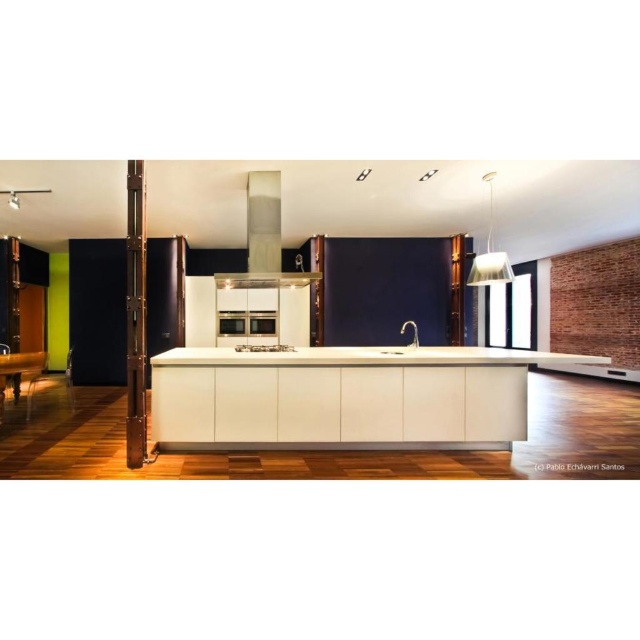
You are standing in the modern kitchen and want to place a small plant between the two points, point (237, 426) and point (257, 362). Which point should the plant be closer to in order to be closer to the viewer?

The plant should be closer to point (237, 426) because it is further to the viewer than point (257, 362).

You are standing in the kitchen and want to place a hot pot on the counter near the oven. Since both the white glossy counter top at center and the satin nickel oven at center are in your view, which surface should you choose to place the pot?

The white glossy counter top at center is closer to the viewer than the satin nickel oven at center, so you should place the hot pot on the white glossy counter top at center because it is nearer to you.